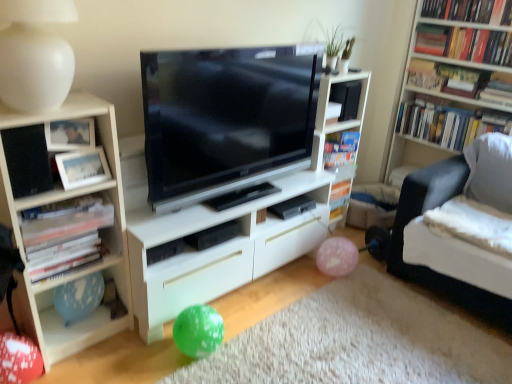
Locate an element on the screen. This screenshot has width=512, height=384. vacant space that's between white matte shelf at center, which appears as the first shelf when viewed from the left, and light wood bookcase at left is located at coordinates (110, 353).